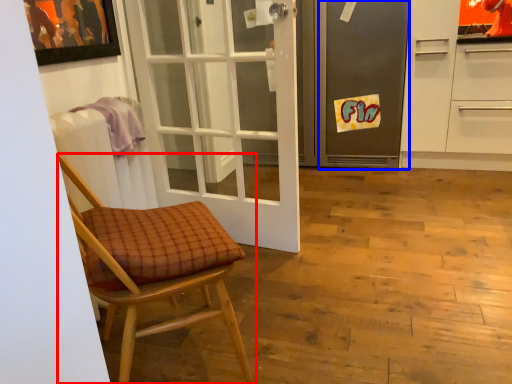
Question: Which object appears farthest to the camera in this image, chair (highlighted by a red box) or screen door (highlighted by a blue box)?

Choices:
 (A) chair
 (B) screen door

Answer: (B)